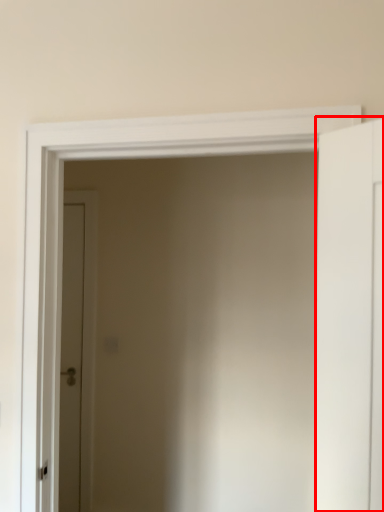
Question: From the image, what is the correct spatial relationship of door (annotated by the red box) in relation to door?

Choices:
 (A) left
 (B) right

Answer: (B)